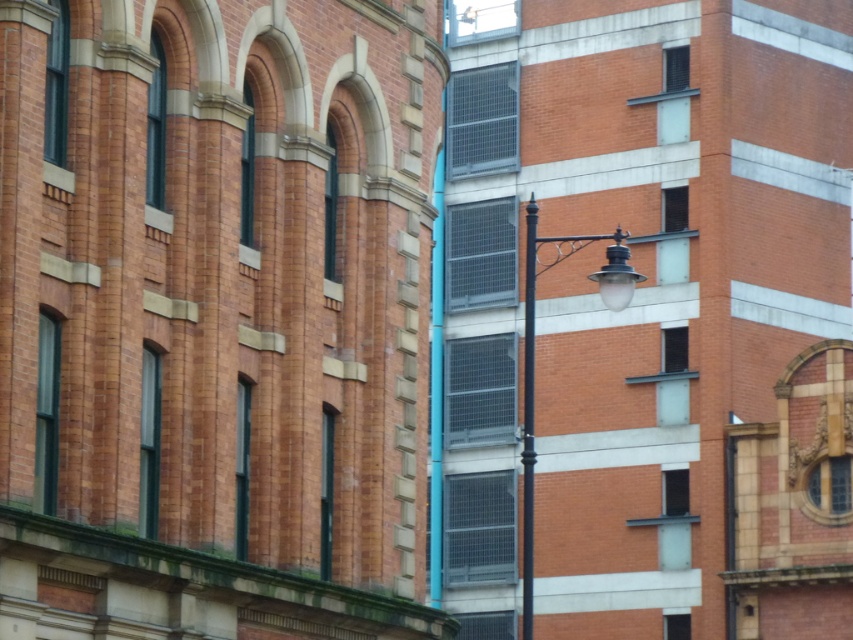
Can you confirm if black metal lamp post at center is positioned to the right of black wrought iron pole at center?

Indeed, black metal lamp post at center is positioned on the right side of black wrought iron pole at center.

How much distance is there between black metal lamp post at center and black wrought iron pole at center?

They are 25.40 inches apart.

Identify the location of black metal lamp post at center. The image size is (853, 640). (532, 355).